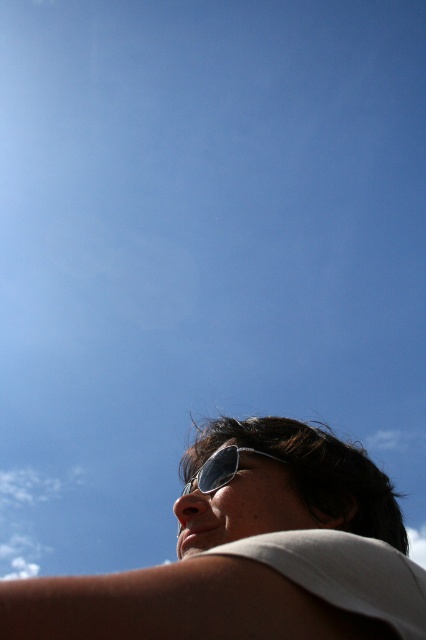
You are a photographer trying to capture the metallic reflective sunglasses at lower center in your shot. The white fluffy cloud at upper left is causing glare. Which object is higher in the frame to help you adjust your camera angle?

The white fluffy cloud at upper left is taller than metallic reflective sunglasses at lower center, so it is higher in the frame. Adjust your camera angle to position the sunglasses below the cloud to reduce glare.

You are a photographer trying to capture a closeup shot of the white matte sunglasses at upper center. You are currently standing 25.91 inches away from the sunglasses. Is this distance sufficient to focus on the sunglasses without any adjustments?

The white matte sunglasses at upper center and camera are 25.91 inches apart from each other. This distance is sufficient to focus on the sunglasses without needing any adjustments as most cameras can focus at this distance.